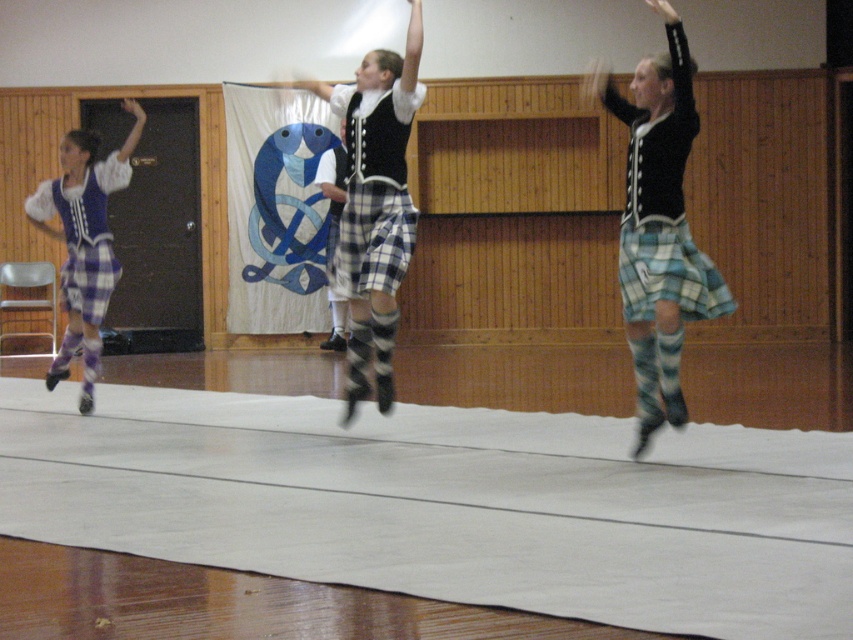
In the scene shown: You are a photographer standing in front of the dancers. You want to take a photo of the plaid fabric skirt at center and the plaid fabric skirt at left. Which skirt will appear larger in your photo?

The plaid fabric skirt at center will appear larger in the photo because it is closer to the viewer than the plaid fabric skirt at left.

You are a photographer at the dance hall and want to capture a closeup of both the plaid fabric skirt at left and the blue plaid kilt at right. Given their sizes, which one should you zoom in more on to ensure both are clearly visible in the photo?

The plaid fabric skirt at left is bigger than the blue plaid kilt at right, so you should zoom in more on the blue plaid kilt at right to ensure both are clearly visible in the photo.

You are a photographer standing in the center of the dance hall. You want to take a picture of both the blue plaid kilt at right and the plaid fabric kilt at left. What is the minimum distance you need to move backward so that both are in frame?

The blue plaid kilt at right and plaid fabric kilt at left are 5.13 meters apart. To capture both in the frame, the photographer needs to move back at least 5.13 meters to ensure both are within the camera view.